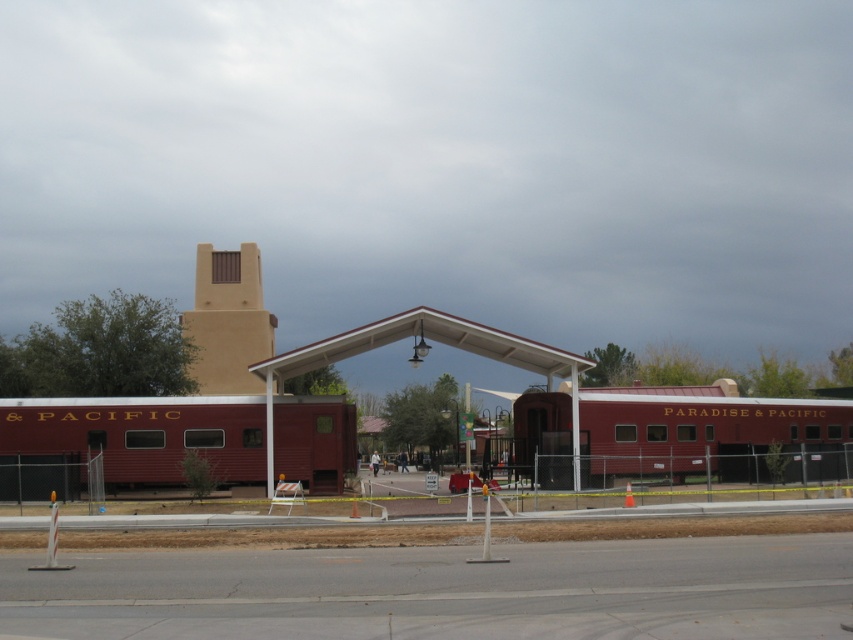
Question: Which is farther from the matte red train car at center?

Choices:
 (A) white matte railway station at center
 (B) matte red passenger train at center

Answer: (B)

Question: From the image, what is the correct spatial relationship of matte red passenger train at center in relation to white matte railway station at center?

Choices:
 (A) right
 (B) left

Answer: (A)

Question: Estimate the real-world distances between objects in this image. Which object is farther from the matte red passenger train at center?

Choices:
 (A) white matte railway station at center
 (B) matte red train car at center

Answer: (B)

Question: Which object is positioned farthest from the matte red train car at center?

Choices:
 (A) matte red passenger train at center
 (B) white matte railway station at center

Answer: (A)

Question: Does matte red train car at center have a larger size compared to white matte railway station at center?

Choices:
 (A) yes
 (B) no

Answer: (B)

Question: Is matte red passenger train at center positioned at the back of white matte railway station at center?

Choices:
 (A) no
 (B) yes

Answer: (B)